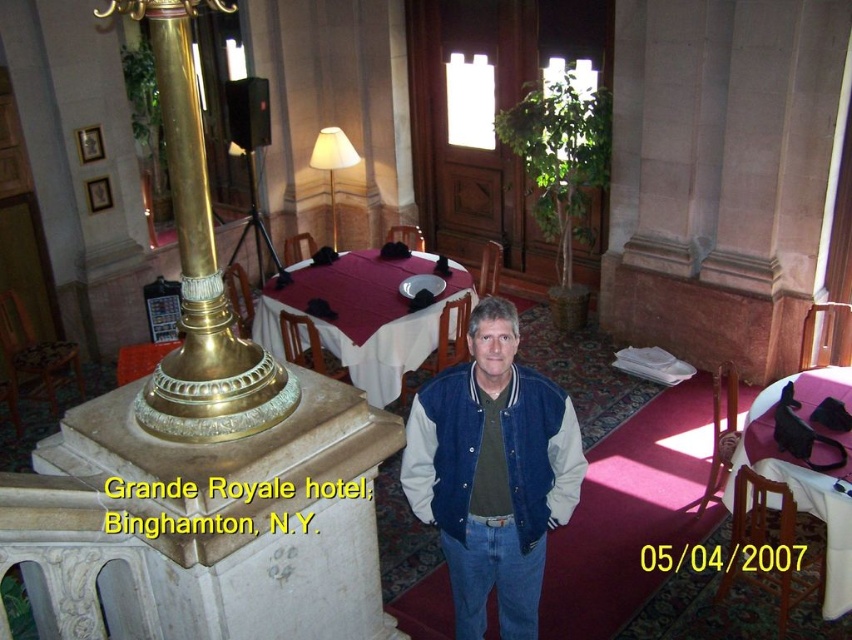
In the scene shown: You are a guest at the Grande Royale hotel and want to place a small vase on either the blue suede jacket at center or the pink fabric table at lower right. Which surface would be more stable for the vase?

The pink fabric table at lower right is more stable for placing the vase since the blue suede jacket at center is taller and might not provide a flat surface for the vase to stay upright.

You are a photographer standing at the camera position. You want to adjust your position so that the blue suede jacket at center is exactly 10 feet away from you. Should you move closer or farther away from the current position?

The blue suede jacket at center is currently 8.57 feet away from the camera. To make it 10 feet away, you need to move farther away from the current position.